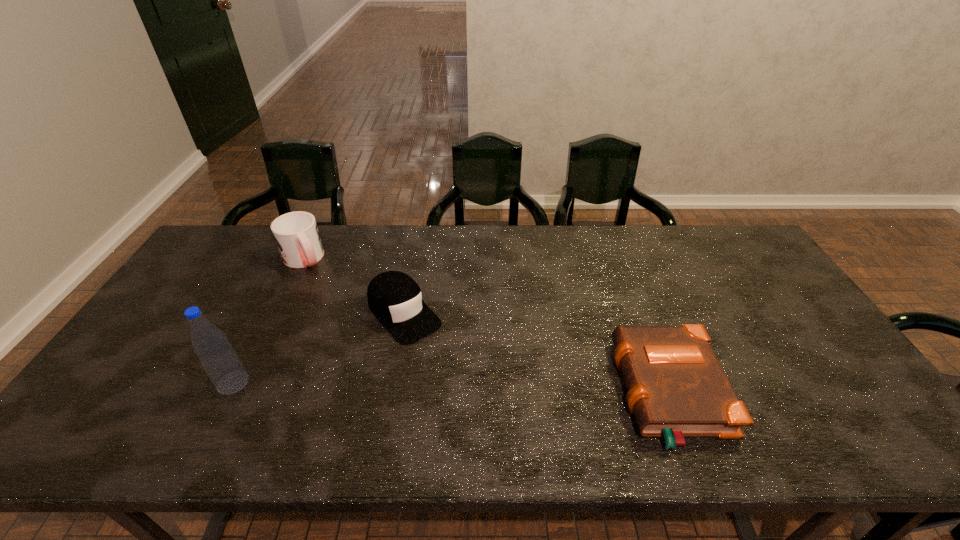
Locate an element on the screen. This screenshot has width=960, height=540. free space between the mug and the cap is located at coordinates (354, 286).

You are a GUI agent. You are given a task and a screenshot of the screen. Output one action in this format:
    pyautogui.click(x=<x>, y=<y>)
    Task: Click on the free space between the second object from right to left and the water bottle
    The image size is (960, 540).
    Given the screenshot: What is the action you would take?
    pyautogui.click(x=319, y=348)

The height and width of the screenshot is (540, 960). Find the location of `free space between the water bottle and the farthest object`. free space between the water bottle and the farthest object is located at coordinates (269, 321).

What are the coordinates of `free spot between the second object from right to left and the mug` in the screenshot? It's located at (354, 286).

This screenshot has height=540, width=960. What are the coordinates of `free space between the second shortest object and the shortest object` in the screenshot? It's located at (537, 354).

Locate which object is the third closest to the second tallest object. Please provide its 2D coordinates. Your answer should be formatted as a tuple, i.e. [(x, y)], where the tuple contains the x and y coordinates of a point satisfying the conditions above.

[(676, 386)]

The width and height of the screenshot is (960, 540). I want to click on object that ranks as the closest to the mug, so click(395, 299).

Locate an element on the screen. Image resolution: width=960 pixels, height=540 pixels. free spot that satisfies the following two spatial constraints: 1. on the front side of the Bible; 2. on the spine side of the farthest object is located at coordinates (239, 393).

The width and height of the screenshot is (960, 540). I want to click on free space that satisfies the following two spatial constraints: 1. on the front side of the third object from left to right; 2. on the right side of the third shortest object, so click(x=277, y=314).

Where is `free space that satisfies the following two spatial constraints: 1. on the back side of the second object from right to left; 2. on the left side of the water bottle`? The image size is (960, 540). free space that satisfies the following two spatial constraints: 1. on the back side of the second object from right to left; 2. on the left side of the water bottle is located at coordinates (268, 314).